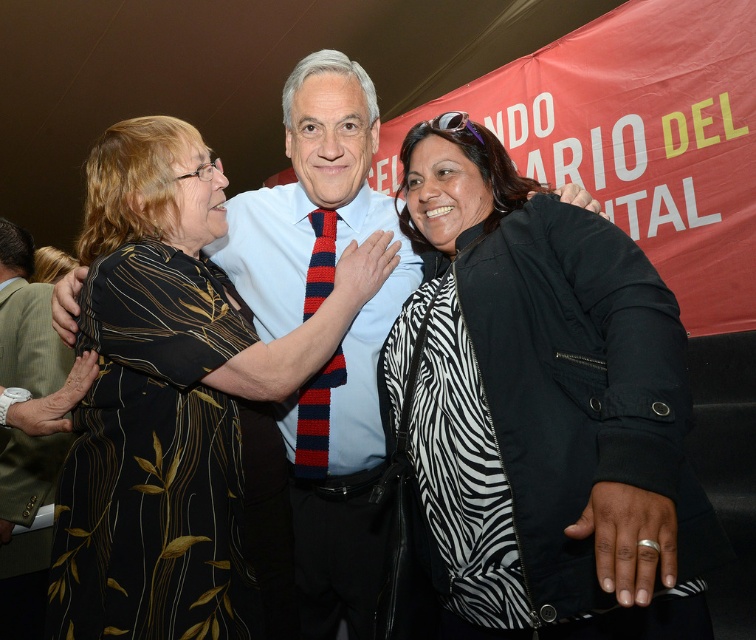
Question: Which point is farther from the camera taking this photo?

Choices:
 (A) (115, 188)
 (B) (420, 442)
 (C) (339, 368)

Answer: (C)

Question: Which point appears farthest from the camera in this image?

Choices:
 (A) (541, 593)
 (B) (305, 317)
 (C) (163, 518)

Answer: (B)

Question: Does black printed dress at center have a larger size compared to knitted red and navy striped tie at center?

Choices:
 (A) no
 (B) yes

Answer: (B)

Question: Does black printed dress at center appear on the right side of knitted red and navy striped tie at center?

Choices:
 (A) no
 (B) yes

Answer: (A)

Question: Can you confirm if zebra print jacket at center is smaller than black printed dress at center?

Choices:
 (A) no
 (B) yes

Answer: (A)

Question: Which point is closer to the camera?

Choices:
 (A) (555, 337)
 (B) (218, 525)
 (C) (318, 211)

Answer: (A)